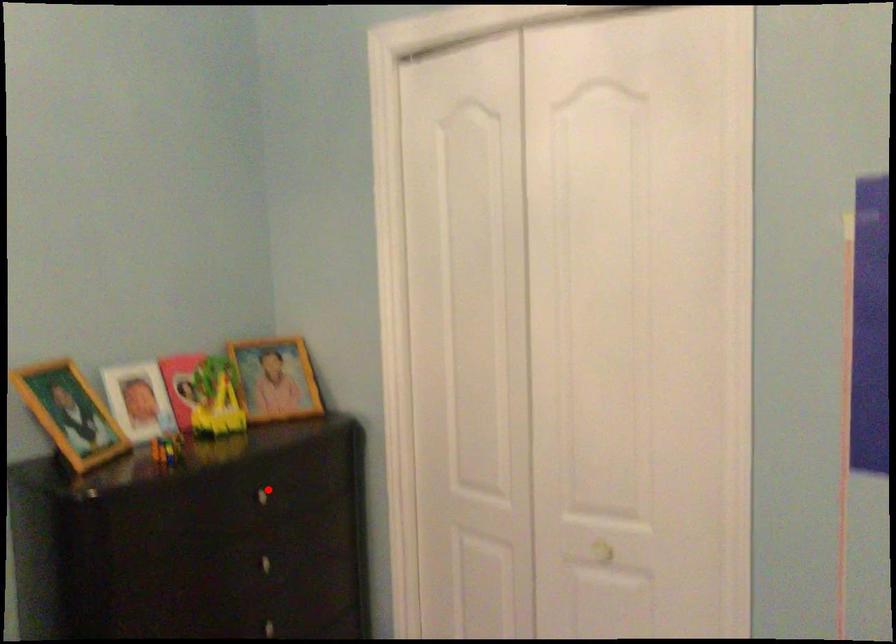
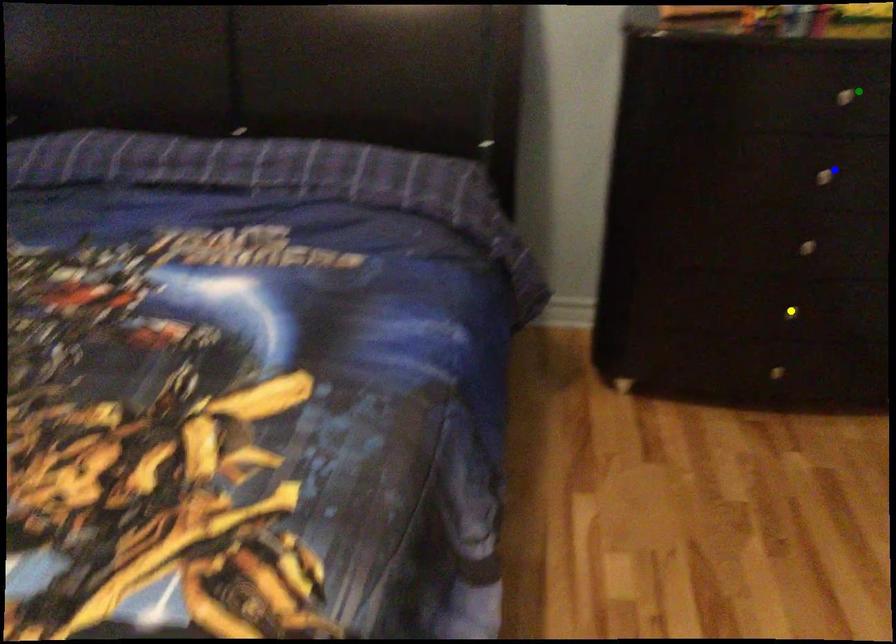
Question: I am providing you with two images of the same scene from different viewpoints. A red point is marked on the first image. You are given multiple points on the second image. Can you choose the point in image 2 that corresponds to the point in image 1?

Choices:
 (A) green point
 (B) blue point
 (C) yellow point

Answer: (A)